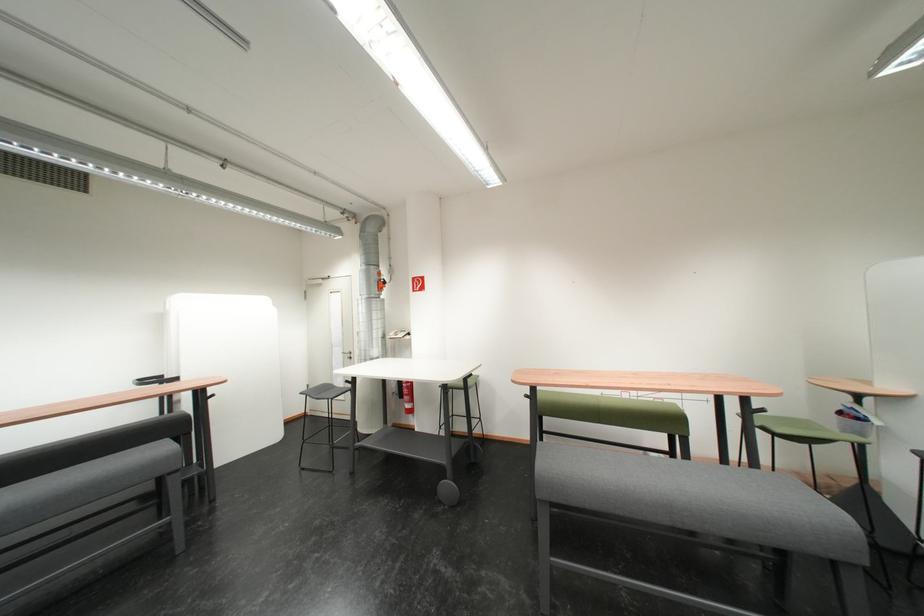
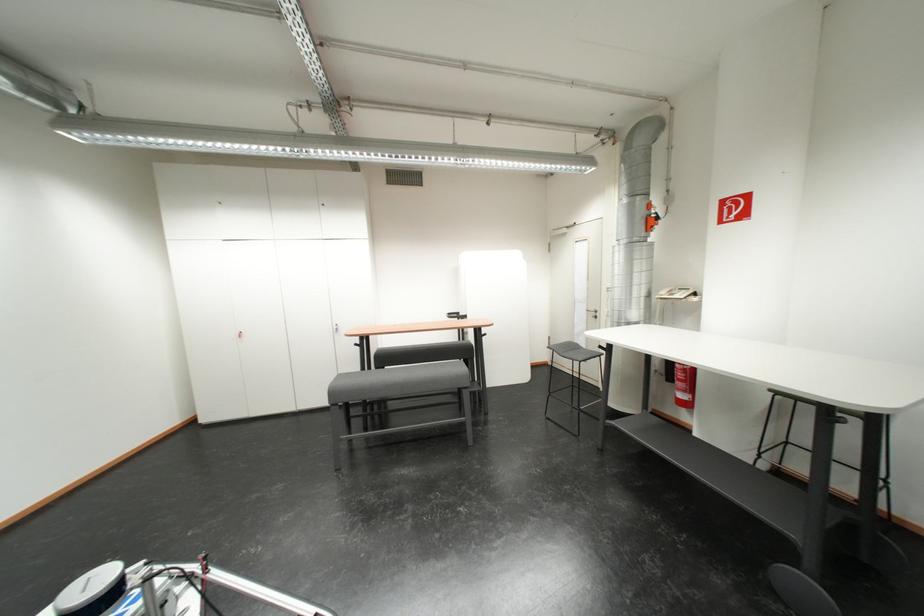
Question: The images are taken continuously from a first-person perspective. In which direction is your viewpoint rotating?

Choices:
 (A) Left
 (B) Right
 (C) Up
 (D) Down

Answer: (A)